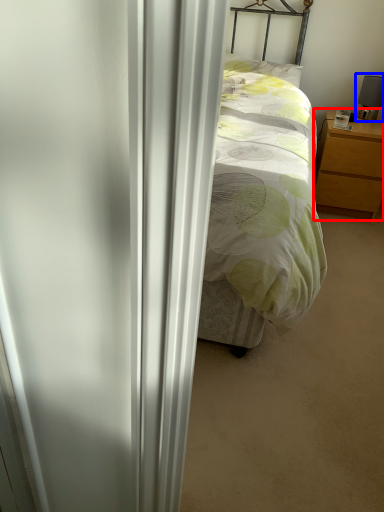
Question: Which object is closer to the camera taking this photo, nightstand (highlighted by a red box) or table lamp (highlighted by a blue box)?

Choices:
 (A) nightstand
 (B) table lamp

Answer: (A)